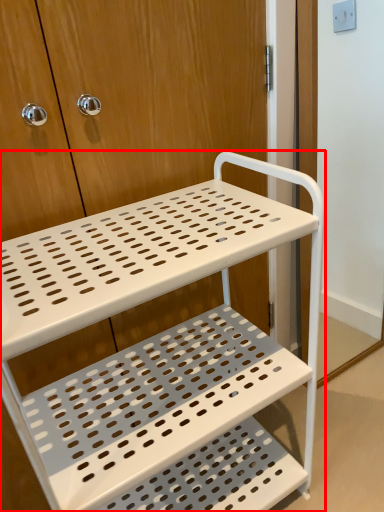
Question: From the image's perspective, where is furniture (annotated by the red box) located relative to screen door?

Choices:
 (A) above
 (B) below

Answer: (B)